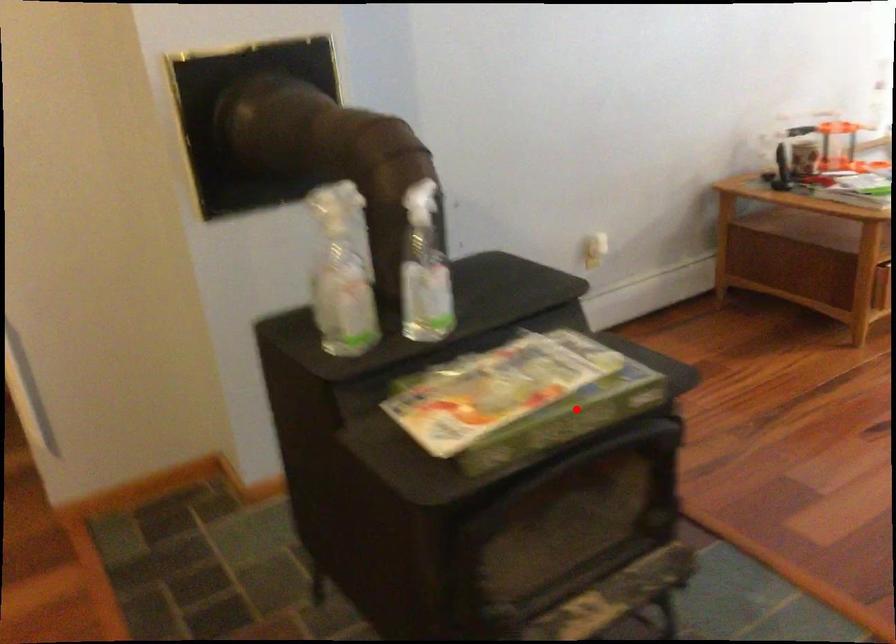
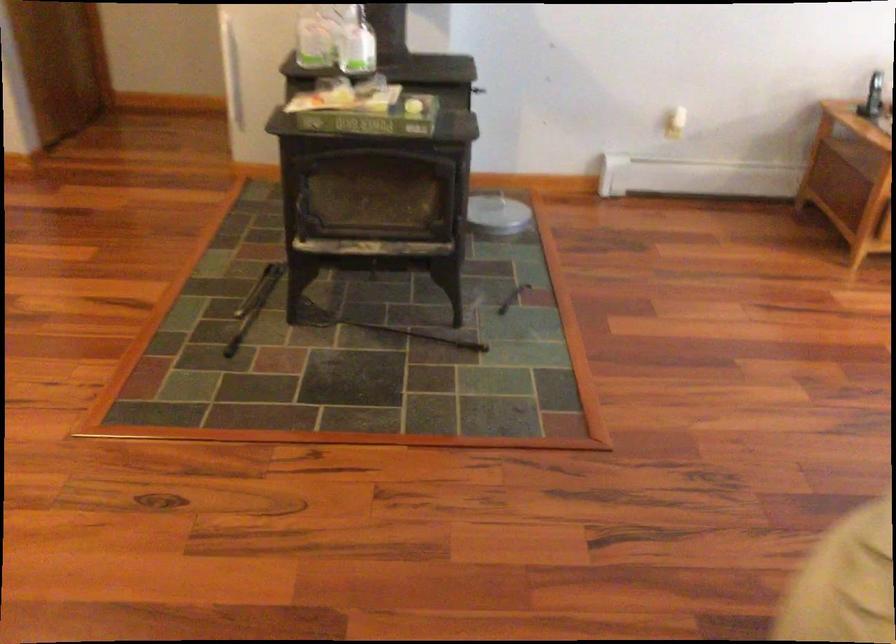
Question: I am providing you with two images of the same scene from different viewpoints. Image1 has a red point marked. In image2, the corresponding 3D location appears at what relative position? Reply with the corresponding letter.

Choices:
 (A) Closer
 (B) Farther

Answer: (B)